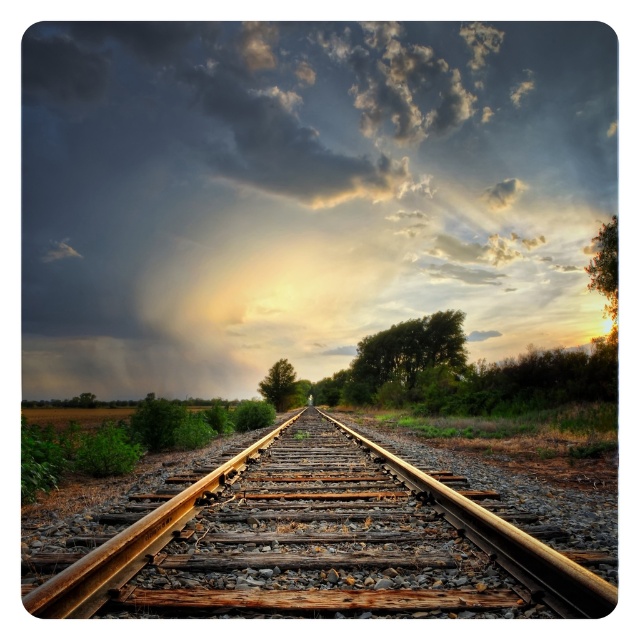
Question: Among these points, which one is farthest from the camera?

Choices:
 (A) (404, 113)
 (B) (417, 349)
 (C) (292, 380)

Answer: (A)

Question: Which point is closer to the camera?

Choices:
 (A) green leafy tree at center
 (B) dark gray cloud at upper center
 (C) green leafy tree at right

Answer: (C)

Question: Does rusty metal train track at center appear on the right side of green leafy tree at right?

Choices:
 (A) yes
 (B) no

Answer: (B)

Question: Which of the following is the farthest from the observer?

Choices:
 (A) (317, 240)
 (B) (339, 561)
 (C) (605, 244)
 (D) (360, 353)

Answer: (A)

Question: Can you confirm if green leafy tree at right is bigger than green leafy tree at center?

Choices:
 (A) yes
 (B) no

Answer: (A)

Question: Is green leafy tree at right closer to the viewer compared to green leafy tree at upper right?

Choices:
 (A) no
 (B) yes

Answer: (A)